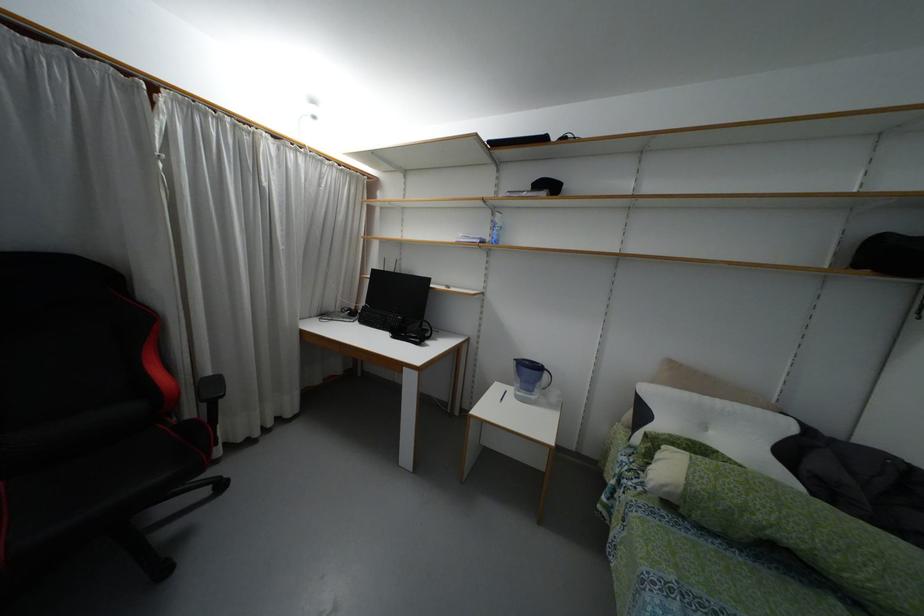
I want to click on white and black pillow, so click(x=712, y=418).